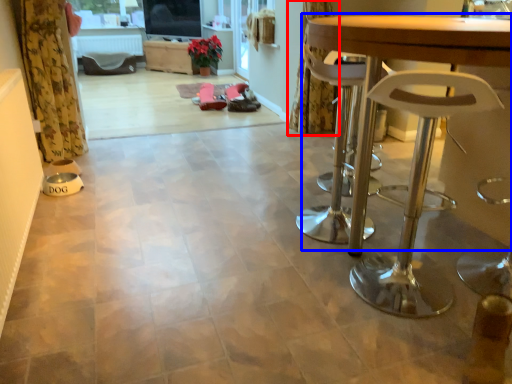
Question: Which of the following is the farthest to the observer, curtain (highlighted by a red box) or table (highlighted by a blue box)?

Choices:
 (A) curtain
 (B) table

Answer: (A)